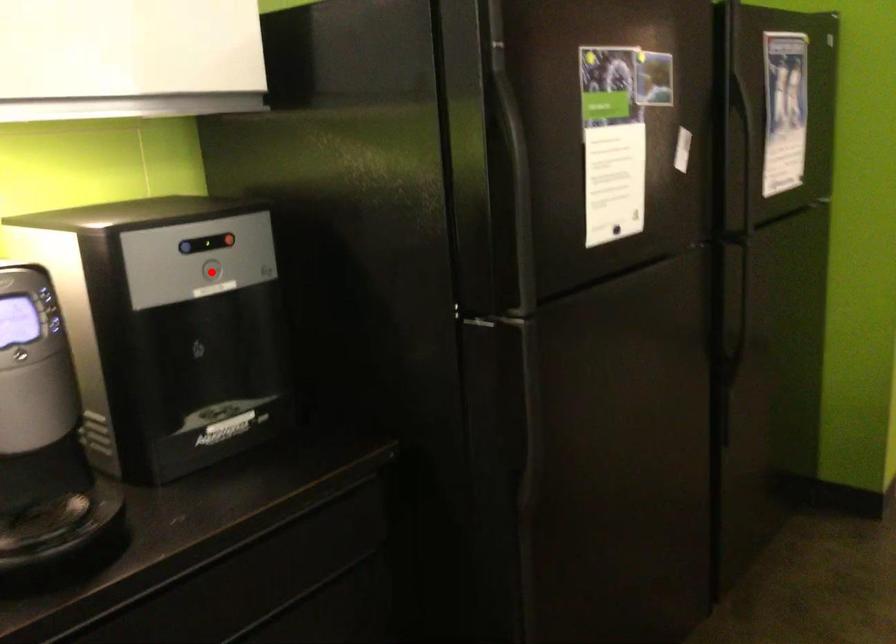
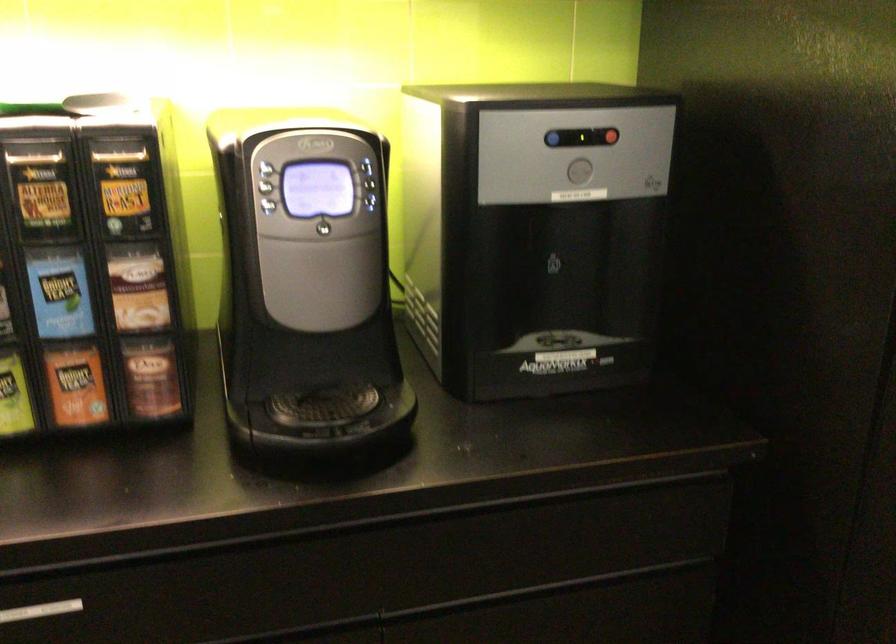
Question: I am providing you with two images of the same scene from different viewpoints. A red point is shown in image1. For the corresponding object point in image2, is it positioned nearer or farther from the camera?

Choices:
 (A) Nearer
 (B) Farther

Answer: (A)